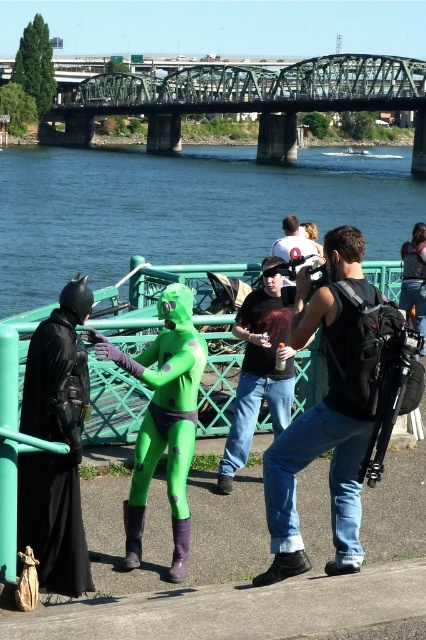
You are standing at the camera position and want to reach point (330, 285). If your walking speed is 3 feet per second, how many seconds will it take you to reach that point?

The distance between you and point (330, 285) is 37.56 feet. At a speed of 3 feet per second, it would take 12.52 seconds to reach the point.

You are standing on the riverside walkway and want to move from point A to point B. Point A is at coordinates point (112, 216) and point B is at coordinates point (163, 339). Since you can only move forward, will you pass closer to the walkway railing or further away from it while moving from point A to point B?

Since point (112, 216) is further to the viewer than point (163, 339), moving from point A to point B means you are moving away from the viewer. Therefore, you will be getting closer to the walkway railing as you move forward.